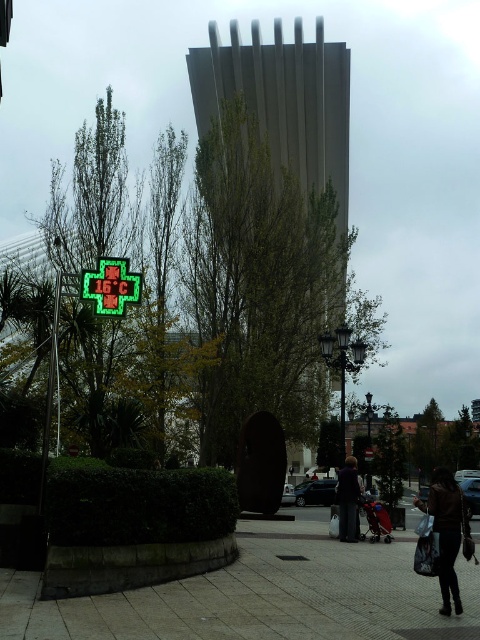
Between point (312, 576) and point (115, 314), which one is positioned behind?

The point (115, 314) is more distant.

Looking at this image, is gray concrete pavement at lower center smaller than green led sign at lower left?

Incorrect, gray concrete pavement at lower center is not smaller in size than green led sign at lower left.

Between point (278, 568) and point (127, 285), which one is positioned in front?

Point (127, 285) is more forward.

You are a GUI agent. You are given a task and a screenshot of the screen. Output one action in this format:
    pyautogui.click(x=<x>, y=<y>)
    Task: Click on the gray concrete pavement at lower center
    Image resolution: width=480 pixels, height=640 pixels.
    Given the screenshot: What is the action you would take?
    pyautogui.click(x=263, y=595)

Between smooth gray tower at center and dark gray suit at center, which one is positioned higher?

smooth gray tower at center is above.

Is smooth gray tower at center closer to the viewer compared to dark gray suit at center?

No, it is behind dark gray suit at center.

From the picture: Who is more forward, [346,48] or [356,470]?

Point [356,470]

At what (x,y) coordinates should I click in order to perform the action: click on smooth gray tower at center. Please return your answer as a coordinate pair (x, y). The height and width of the screenshot is (640, 480). Looking at the image, I should click on (271, 224).

Does dark brown leather jacket at lower right appear under dark gray suit at center?

Incorrect, dark brown leather jacket at lower right is not positioned below dark gray suit at center.

Describe the element at coordinates (446, 529) in the screenshot. I see `dark brown leather jacket at lower right` at that location.

You are a GUI agent. You are given a task and a screenshot of the screen. Output one action in this format:
    pyautogui.click(x=<x>, y=<y>)
    Task: Click on the dark brown leather jacket at lower right
    This screenshot has height=640, width=480.
    Given the screenshot: What is the action you would take?
    pyautogui.click(x=446, y=529)